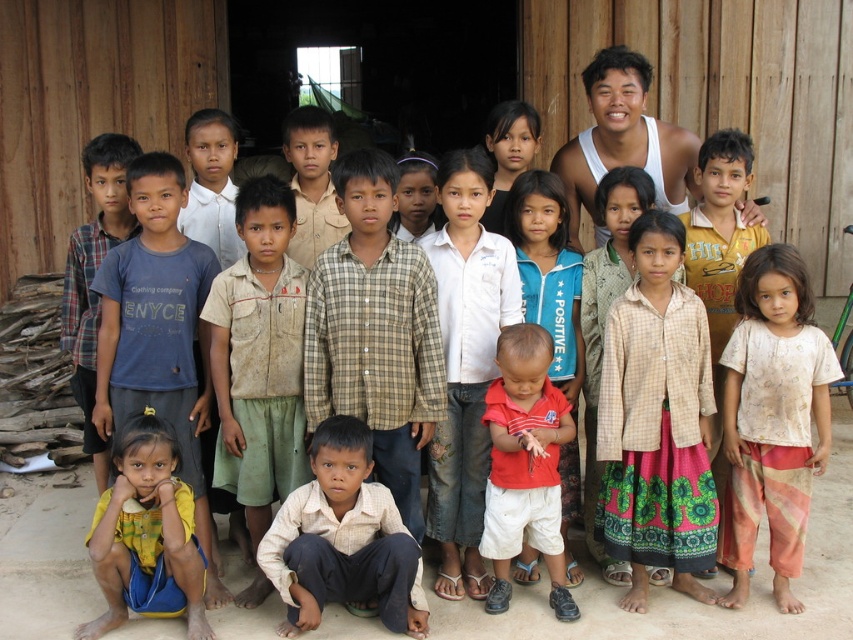
Question: Is the position of light brown cotton shirt at center more distant than that of white tank top at upper right?

Choices:
 (A) no
 (B) yes

Answer: (A)

Question: Is light beige printed shirt at lower right smaller than blue fleece jacket at center?

Choices:
 (A) no
 (B) yes

Answer: (A)

Question: Which object is positioned farthest from the checkered fabric shirt at center?

Choices:
 (A) blue fleece jacket at center
 (B) light beige printed shirt at lower right

Answer: (A)

Question: Can you confirm if checkered fabric shirt at center is thinner than light beige printed shirt at lower right?

Choices:
 (A) yes
 (B) no

Answer: (B)

Question: Which point is closer to the camera?

Choices:
 (A) (563, 244)
 (B) (682, 323)
 (C) (103, 182)

Answer: (B)

Question: Considering the real-world distances, which object is farthest from the light brown plaid shirt at center?

Choices:
 (A) light brown cotton shirt at center
 (B) yellow fabric at lower left
 (C) dirty blue shirt at left
 (D) blue fleece jacket at center

Answer: (C)